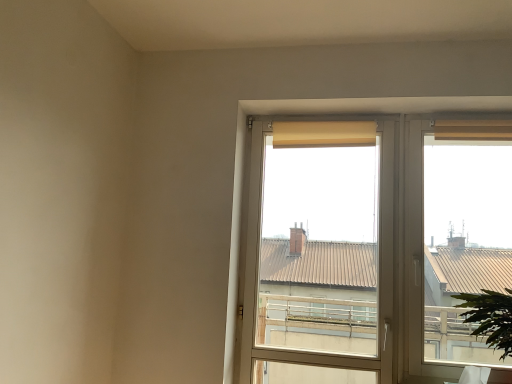
Question: Is green leafy plant at lower right outside of beige fabric curtain at upper right, the first curtain positioned from the right?

Choices:
 (A) no
 (B) yes

Answer: (B)

Question: Is green leafy plant at lower right facing away from beige fabric curtain at upper right, acting as the 2th curtain starting from the left?

Choices:
 (A) no
 (B) yes

Answer: (A)

Question: From a real-world perspective, is green leafy plant at lower right physically below beige fabric curtain at upper right, acting as the 2th curtain starting from the left?

Choices:
 (A) no
 (B) yes

Answer: (B)

Question: Considering the relative sizes of green leafy plant at lower right and beige fabric curtain at upper right, the first curtain positioned from the right, in the image provided, is green leafy plant at lower right thinner than beige fabric curtain at upper right, the first curtain positioned from the right,?

Choices:
 (A) no
 (B) yes

Answer: (A)

Question: From a real-world perspective, is green leafy plant at lower right located higher than beige fabric curtain at upper right, acting as the 2th curtain starting from the left?

Choices:
 (A) yes
 (B) no

Answer: (B)

Question: Is matte glass window at center wider or thinner than beige fabric curtain at upper right, the first curtain positioned from the right?

Choices:
 (A) thin
 (B) wide

Answer: (B)

Question: Based on their sizes in the image, would you say matte glass window at center is bigger or smaller than beige fabric curtain at upper right, acting as the 2th curtain starting from the left?

Choices:
 (A) small
 (B) big

Answer: (B)

Question: In terms of height, does matte glass window at center look taller or shorter compared to beige fabric curtain at upper right, acting as the 2th curtain starting from the left?

Choices:
 (A) short
 (B) tall

Answer: (B)

Question: Visually, is matte glass window at center positioned to the left or to the right of beige fabric curtain at upper right, acting as the 2th curtain starting from the left?

Choices:
 (A) left
 (B) right

Answer: (A)

Question: Is matte glass window at center wider or thinner than beige fabric curtain at upper center, the first curtain from the left?

Choices:
 (A) thin
 (B) wide

Answer: (B)

Question: From a real-world perspective, is matte glass window at center above or below beige fabric curtain at upper center, the first curtain from the left?

Choices:
 (A) above
 (B) below

Answer: (B)

Question: In terms of size, does matte glass window at center appear bigger or smaller than beige fabric curtain at upper center, the second curtain positioned from the right?

Choices:
 (A) big
 (B) small

Answer: (A)

Question: Does point (454, 281) appear closer or farther from the camera than point (344, 122)?

Choices:
 (A) closer
 (B) farther

Answer: (A)

Question: Based on their sizes in the image, would you say green leafy plant at lower right is bigger or smaller than beige fabric curtain at upper center, the second curtain positioned from the right?

Choices:
 (A) small
 (B) big

Answer: (B)

Question: Would you say green leafy plant at lower right is to the left or to the right of beige fabric curtain at upper center, the second curtain positioned from the right, in the picture?

Choices:
 (A) right
 (B) left

Answer: (A)